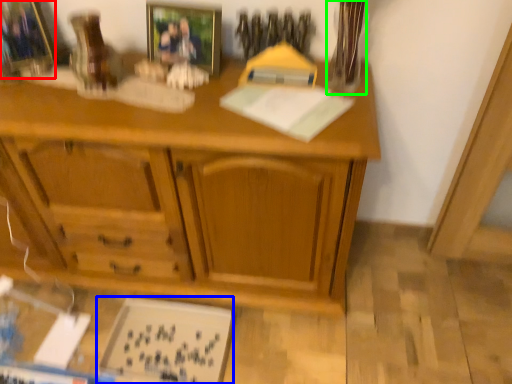
Question: Estimate the real-world distances between objects in this image. Which object is closer to picture frame (highlighted by a red box), book (highlighted by a blue box) or glass vase (highlighted by a green box)?

Choices:
 (A) book
 (B) glass vase

Answer: (B)